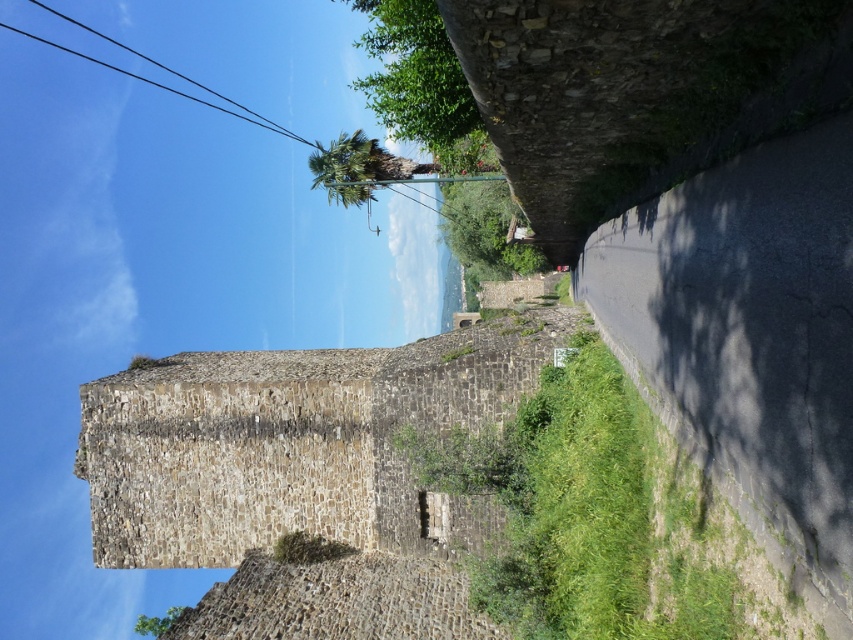
You are standing at the camera position looking at the ancient stone wall and the road. There is a point marked at coordinates point (445, 218). Can you determine if this point is closer to you or farther away compared to the wall?

The point (445, 218) is 114.59 meters from the camera, so it is farther away than the wall since the wall is part of the ancient structure in the scene and the point is at a distance of 114.59 meters.

You are a hiker who wants to take a photo of the ancient stone wall. You notice a green leafy palm at upper center and a black wire at upper left in your viewfinder. Which object should you adjust your camera to focus on first if you want both to be in sharp focus?

You should focus on the black wire at upper left first because it is closer to the camera than the green leafy palm at upper center. Since the black wire at upper left is in front, focusing on it will ensure both objects are in focus due to the depth of field extending backward to the palm.